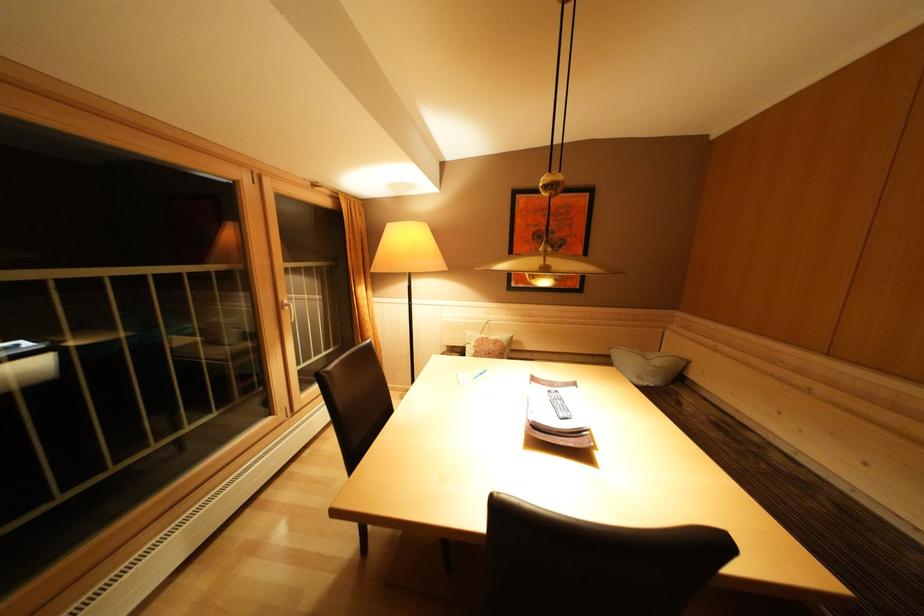
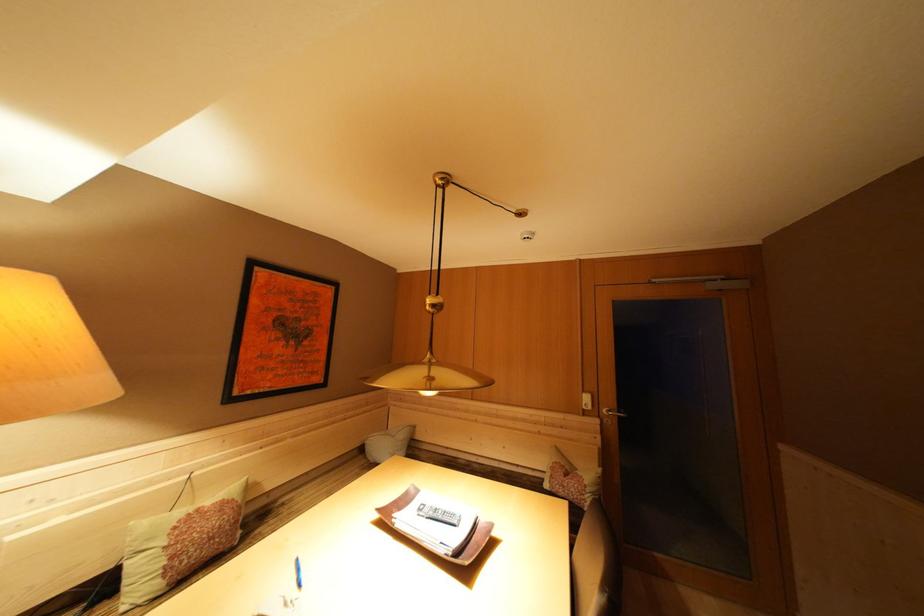
The point at (553, 259) is marked in the first image. Where is the corresponding point in the second image?

(438, 369)